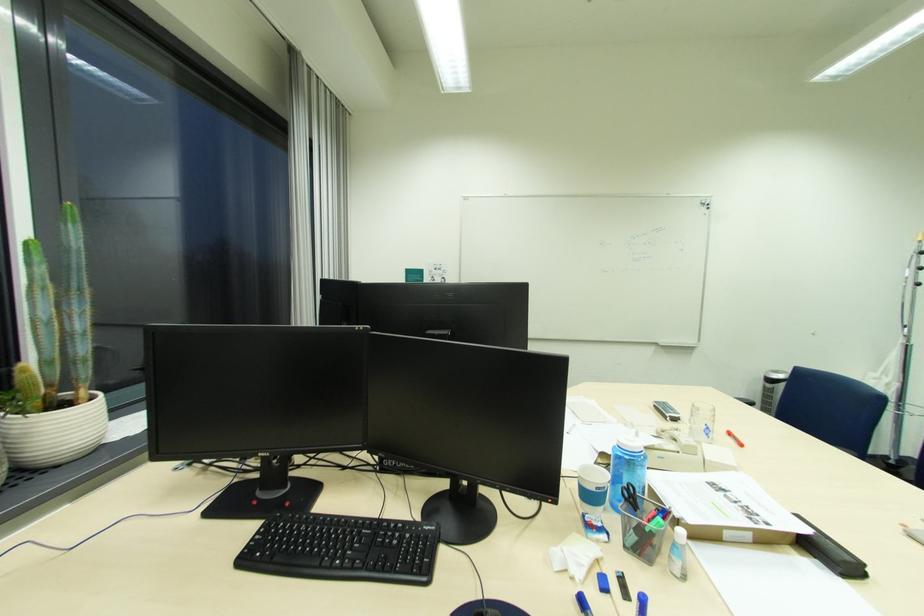
This screenshot has width=924, height=616. I want to click on sanitizer bottle pump, so click(x=630, y=443).